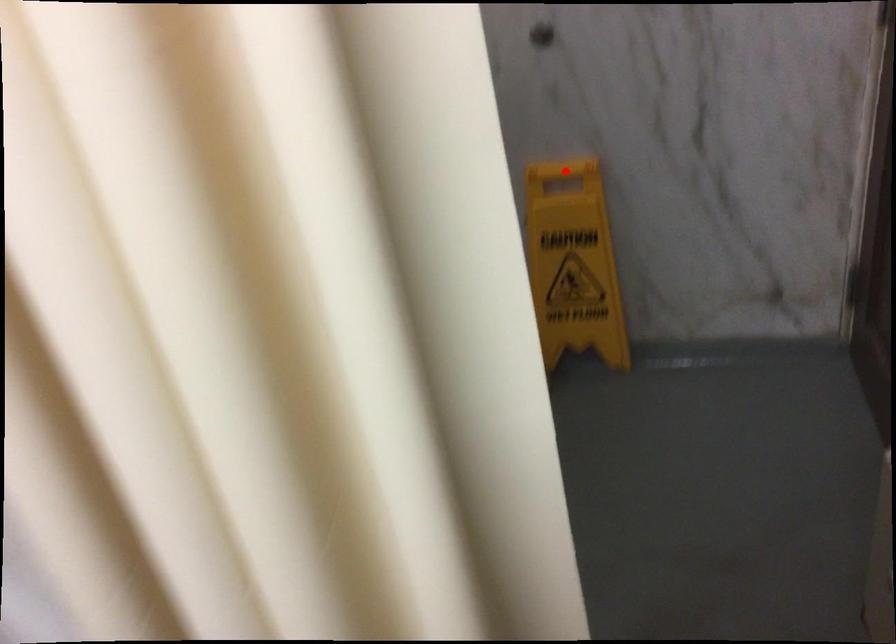
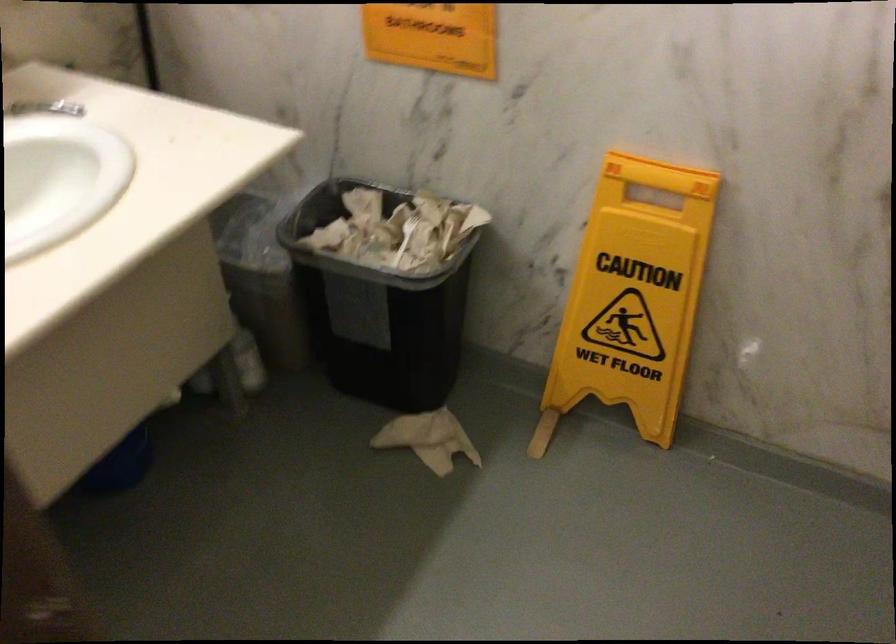
Question: I am providing you with two images of the same scene from different viewpoints. Image1 has a red point marked. In image2, the corresponding 3D location appears at what relative position? Reply with the corresponding letter.

Choices:
 (A) Closer
 (B) Farther

Answer: (A)